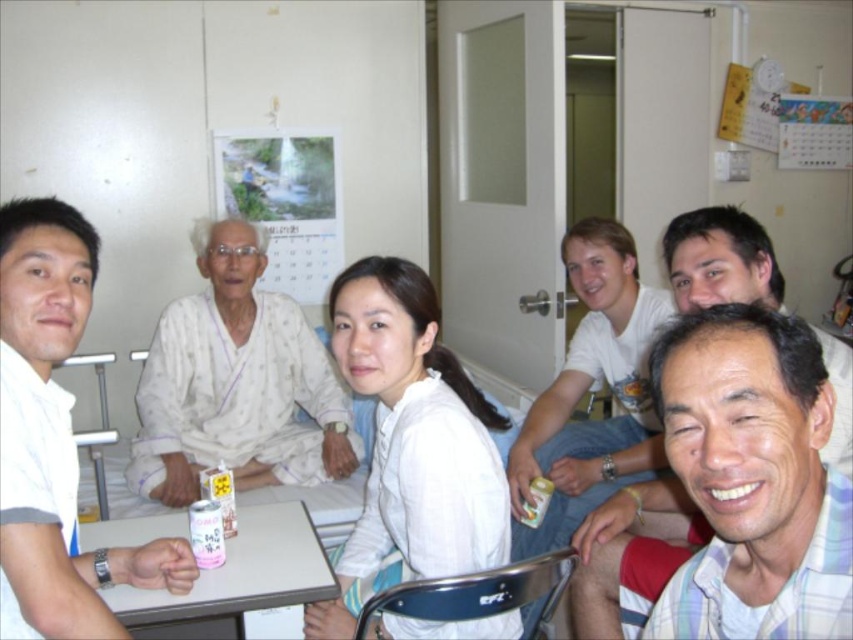
Question: Is white matte shirt at left above white plastic table at lower center?

Choices:
 (A) yes
 (B) no

Answer: (A)

Question: Which of the following is the farthest from the observer?

Choices:
 (A) (668, 484)
 (B) (38, 308)
 (C) (279, 532)
 (D) (195, 376)

Answer: (D)

Question: Which object appears farthest from the camera in this image?

Choices:
 (A) white plastic table at lower center
 (B) white cotton pajamas at center
 (C) white matte shirt at left
 (D) printed paper calendar at upper center

Answer: (D)

Question: Is the position of light brown wood chair at center less distant than that of plaid cotton shirt at center?

Choices:
 (A) no
 (B) yes

Answer: (A)

Question: Is white cotton pajamas at center closer to camera compared to printed paper calendar at upper center?

Choices:
 (A) yes
 (B) no

Answer: (A)

Question: Which point appears closest to the camera in this image?

Choices:
 (A) (331, 456)
 (B) (281, 134)
 (C) (635, 486)
 (D) (149, 534)

Answer: (D)